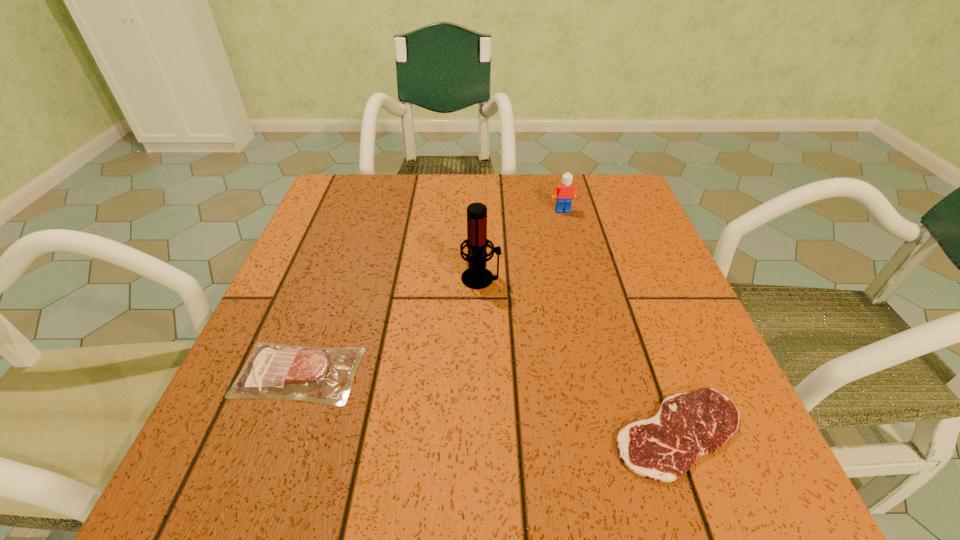
Locate an element on the screen. The image size is (960, 540). free space that is in between the Lego and the microphone is located at coordinates (522, 245).

Where is `free space between the third shortest object and the shorter steak`? free space between the third shortest object and the shorter steak is located at coordinates (621, 322).

In order to click on free space between the leftmost object and the tallest object in this screenshot , I will do `click(390, 326)`.

Image resolution: width=960 pixels, height=540 pixels. Find the location of `free spot between the Lego and the tallest object`. free spot between the Lego and the tallest object is located at coordinates (522, 245).

Point out which object is positioned as the third nearest to the shortest object. Please provide its 2D coordinates. Your answer should be formatted as a tuple, i.e. [(x, y)], where the tuple contains the x and y coordinates of a point satisfying the conditions above.

[(565, 192)]

Locate an element on the screen. The height and width of the screenshot is (540, 960). the second closest object to the third tallest object is located at coordinates (688, 425).

The height and width of the screenshot is (540, 960). What are the coordinates of `blank area in the image that satisfies the following two spatial constraints: 1. on the back side of the tallest object; 2. on the left side of the leftmost object` in the screenshot? It's located at (333, 278).

This screenshot has width=960, height=540. In order to click on free location that satisfies the following two spatial constraints: 1. on the face of the Lego; 2. on the left side of the right steak in this screenshot , I will do `click(618, 433)`.